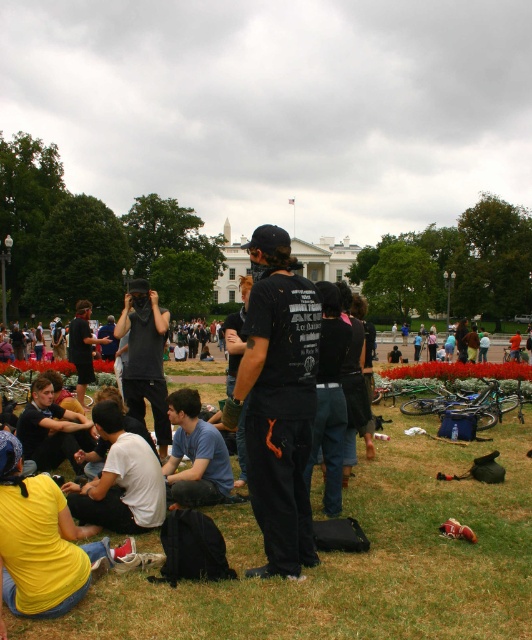
Describe the element at coordinates (355, 557) in the screenshot. The image size is (532, 640). I see `green grass at center` at that location.

You are a GUI agent. You are given a task and a screenshot of the screen. Output one action in this format:
    pyautogui.click(x=<x>, y=<y>)
    Task: Click on the green grass at center
    
    Given the screenshot: What is the action you would take?
    pyautogui.click(x=355, y=557)

Does green grass at center appear on the right side of white matte shirt at lower left?

Indeed, green grass at center is positioned on the right side of white matte shirt at lower left.

Is green grass at center below white matte shirt at lower left?

Yes, green grass at center is below white matte shirt at lower left.

Which is behind, point (458, 605) or point (128, 504)?

The point (128, 504) is more distant.

Image resolution: width=532 pixels, height=640 pixels. What are the coordinates of `green grass at center` in the screenshot? It's located at (355, 557).

Is point (285, 358) positioned behind point (82, 387)?

No, it is in front of (82, 387).

Does black cotton t-shirt at center appear under dark gray hoodie at center?

Correct, black cotton t-shirt at center is located below dark gray hoodie at center.

Between point (311, 380) and point (86, 369), which one is positioned behind?

The point (86, 369) is more distant.

Where is `black cotton t-shirt at center`? black cotton t-shirt at center is located at coordinates (278, 401).